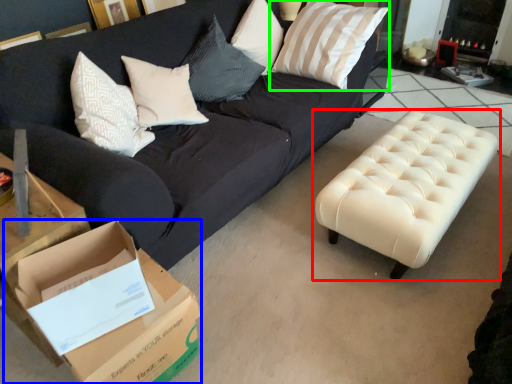
Question: Which object is the closest to the table (highlighted by a red box)? Choose among these: cardboard box (highlighted by a blue box) or pillow (highlighted by a green box).

Choices:
 (A) cardboard box
 (B) pillow

Answer: (B)